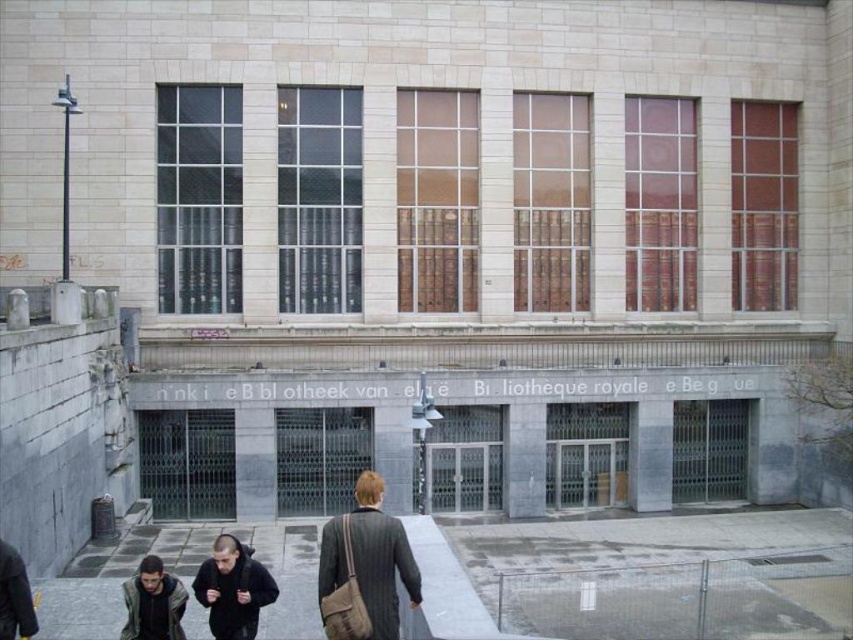
You are standing in front of the Royal Library and notice both the smooth concrete pavement at lower center and the dark gray fabric jacket at lower center. Which object covers a larger area in the scene?

The smooth concrete pavement at lower center is bigger than the dark gray fabric jacket at lower center, so the smooth concrete pavement at lower center covers a larger area in the scene.

You are standing in front of the Royal Library and notice two items of clothing hanging on a rack nearby. The striped wool coat at center and the dark gray fabric jacket at lower center. Which item is taller?

The striped wool coat at center is taller than the dark gray fabric jacket at lower center according to the description.